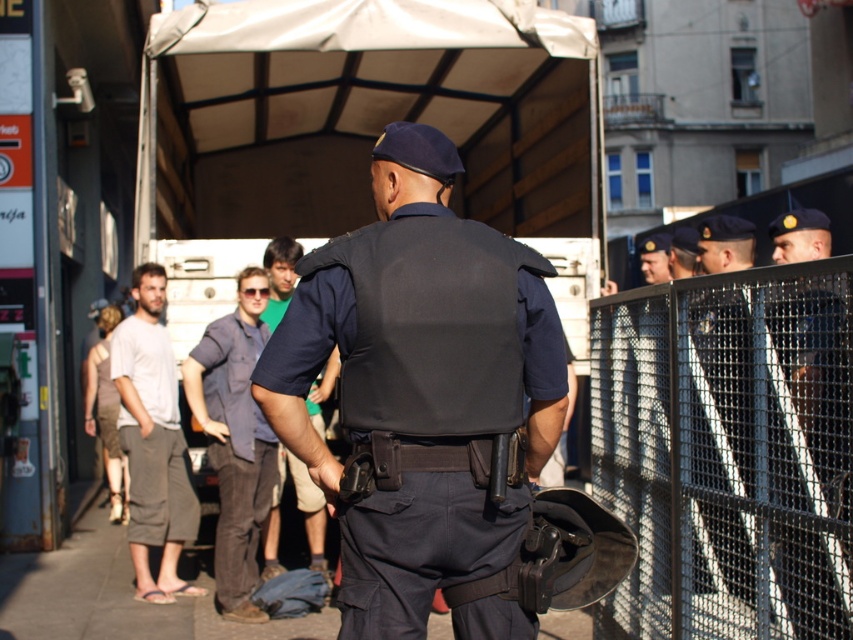
Question: Which of the following is the closest to the observer?

Choices:
 (A) (838, 508)
 (B) (270, 472)
 (C) (668, 241)
 (D) (155, 426)

Answer: (A)

Question: Which point is farther from the camera taking this photo?

Choices:
 (A) (646, 269)
 (B) (107, 378)
 (C) (329, 358)

Answer: (B)

Question: Which point is closer to the camera?

Choices:
 (A) metallic mesh fence at right
 (B) light brown fabric pants at left
 (C) dark blue denim pants at center

Answer: (A)

Question: Where is dark blue denim pants at center located in relation to dark blue shirt at center in the image?

Choices:
 (A) left
 (B) right

Answer: (A)

Question: Can you confirm if dark blue denim pants at center is positioned to the right of light brown fabric pants at left?

Choices:
 (A) no
 (B) yes

Answer: (B)

Question: Is dark blue denim pants at center smaller than dark blue shirt at center?

Choices:
 (A) yes
 (B) no

Answer: (B)